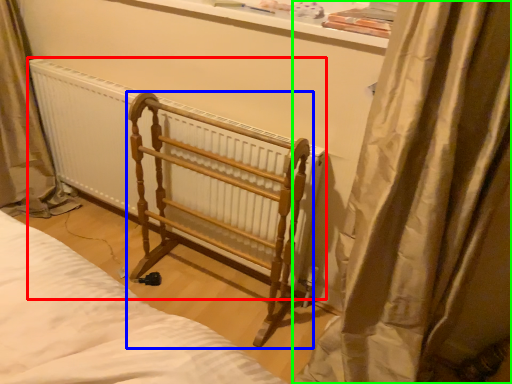
Question: Considering the real-world distances, which object is farthest from radiator (highlighted by a red box)? furniture (highlighted by a blue box) or curtain (highlighted by a green box)?

Choices:
 (A) furniture
 (B) curtain

Answer: (B)